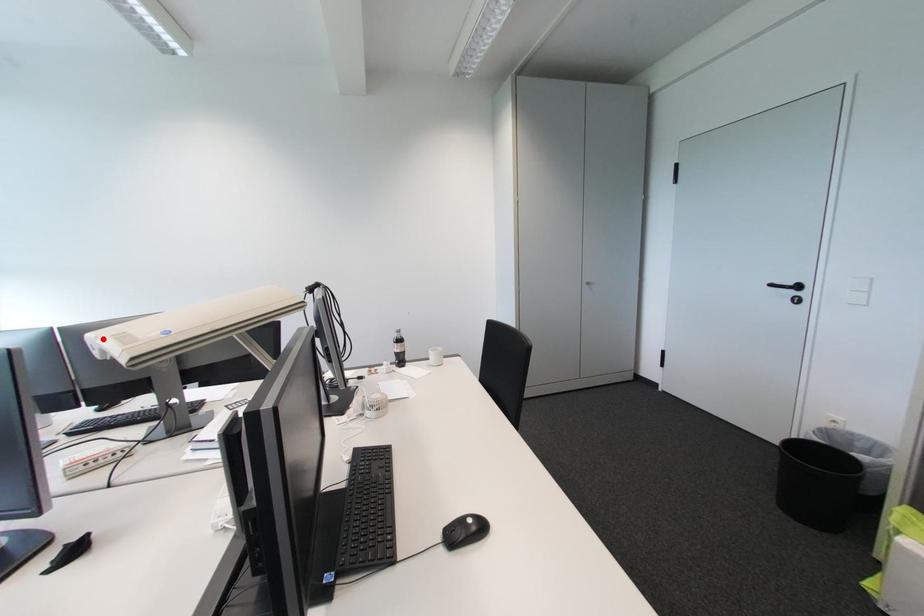
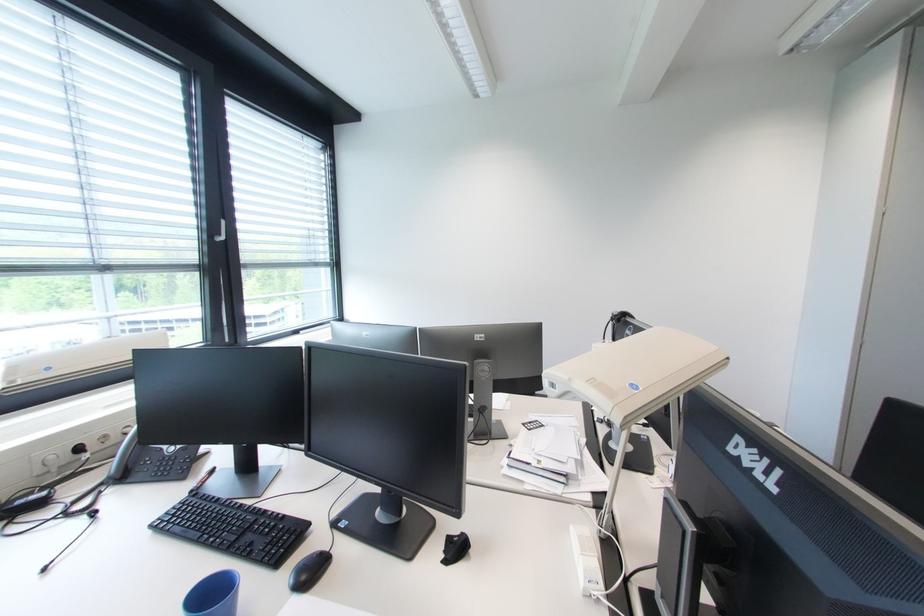
Question: A red point is marked in image1. In image2, is the corresponding 3D point closer to the camera or farther? Reply with the corresponding letter.

Choices:
 (A) The corresponding 3D point is closer.
 (B) The corresponding 3D point is farther.

Answer: (B)